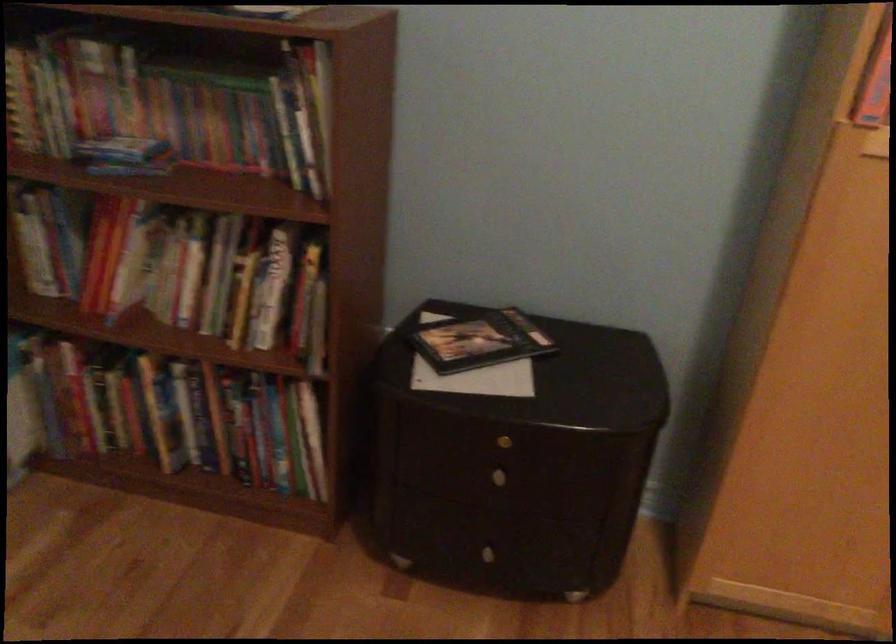
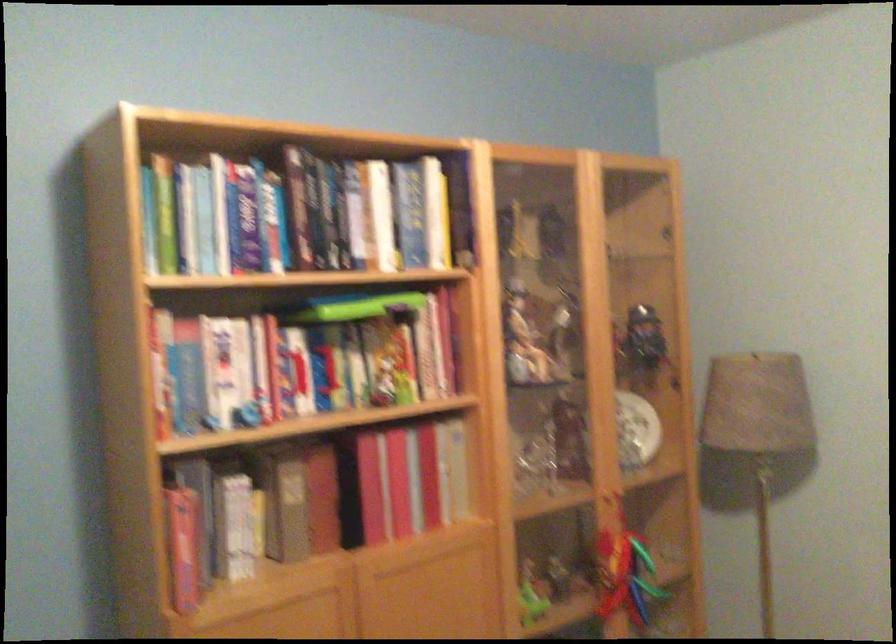
Question: The camera is either moving clockwise (left) or counter-clockwise (right) around the object. The first image is from the beginning of the video and the second image is from the end. Is the camera moving left or right when shooting the video?

Choices:
 (A) Left
 (B) Right

Answer: (A)